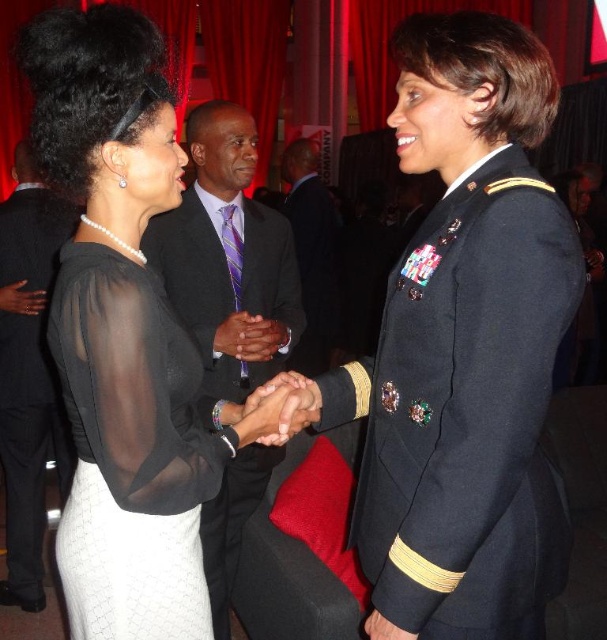
You are a photographer at the event and need to ensure both the navy blue fabric military uniform at center and the matte black suit at center are fully visible in your photo. Which of the two requires more space in the frame to capture its full detail?

The matte black suit at center requires more space in the frame because it is larger than the navy blue fabric military uniform at center.

You are attending a formal event and need to take a photo with the two individuals in the image. You want to ensure that both the black pinstripe suit at center and the dark suit at center are clearly visible in the photo. Since you can only focus on one person at a time, which individual should you focus on to capture both suits in focus?

You should focus on the black pinstripe suit at center because it is closer to the viewer than the dark suit at center, so focusing on it will keep both in focus as the dark suit is further away.

You are standing in the front row of the event and want to take a photo of both the black sheer blouse at center and the navy blue fabric military uniform at center. Which one will appear larger in your photo?

The black sheer blouse at center will appear larger in the photo because it is closer to you than the navy blue fabric military uniform at center.